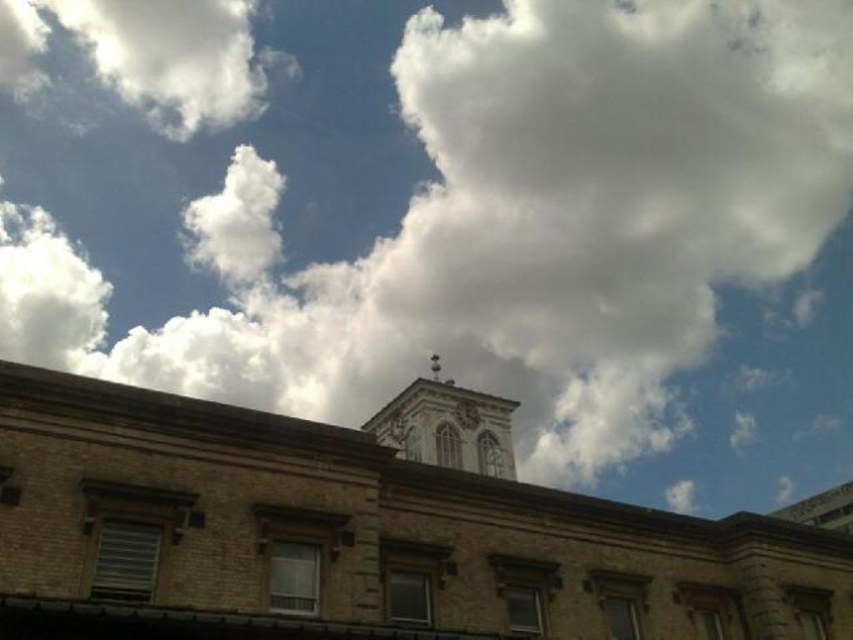
Consider the image. Is brown brick church at center closer to camera compared to smooth stone bell tower at center?

Yes, it is.

Who is positioned more to the left, brown brick church at center or smooth stone bell tower at center?

From the viewer's perspective, smooth stone bell tower at center appears more on the left side.

Is point (422, 522) positioned after point (451, 467)?

That is False.

At what (x,y) coordinates should I click in order to perform the action: click on brown brick church at center. Please return your answer as a coordinate pair (x, y). Looking at the image, I should click on (360, 531).